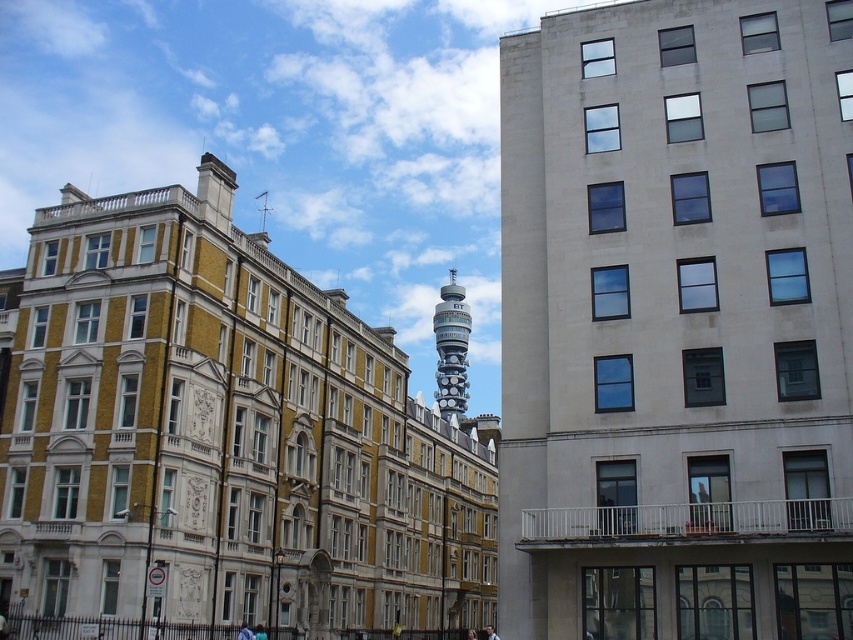
You are a tourist in London and want to take a photo of both the smooth concrete tower at center and the silver metallic bt tower at center. Which tower should you stand closer to in order to fit both in your camera frame?

You should stand closer to the smooth concrete tower at center because it is smaller than the silver metallic bt tower at center, so getting closer will help balance their sizes in the photo.